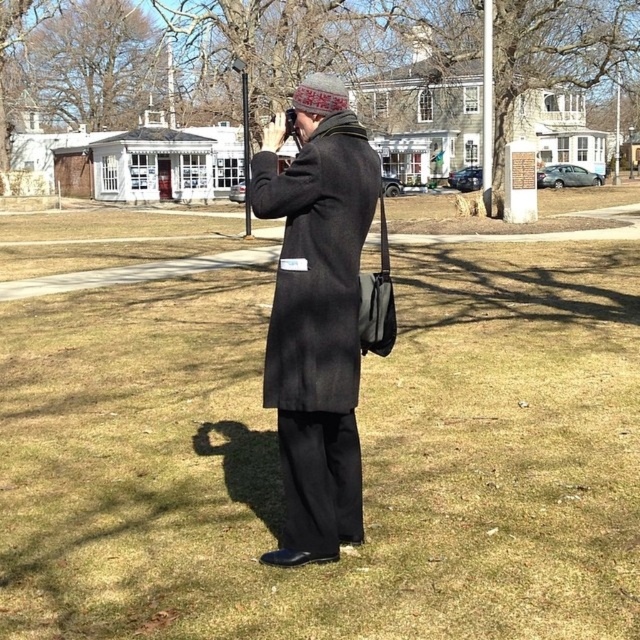
You are a photographer trying to capture a wide landscape shot. You have a camera with a 35mm lens. The green grass at center and the matte black coat at center are in your frame. Considering the width of these objects, will the 35mm lens allow you to capture both objects fully within the frame without cropping?

The green grass at center might be wider than matte black coat at center, so the 35mm lens may not be sufficient to capture both objects fully within the frame without cropping, as the grass could extend beyond the lens width capacity.

You are standing at the edge of the grassy area and want to take a photo of the white building with the red door. Where should you position yourself relative to the green grass at center to frame the shot properly?

The green grass at center is located at point (362, 452), so you should position yourself slightly to the left and forward of the green grass at center to ensure the white building with the red door is centered in your photo.

You are standing in the same spot as the person in the image. Which object is nearer to you, the green grass at center or the matte black coat at center?

The green grass at center is closer to the viewer than the matte black coat at center, so the green grass at center is nearer to you.